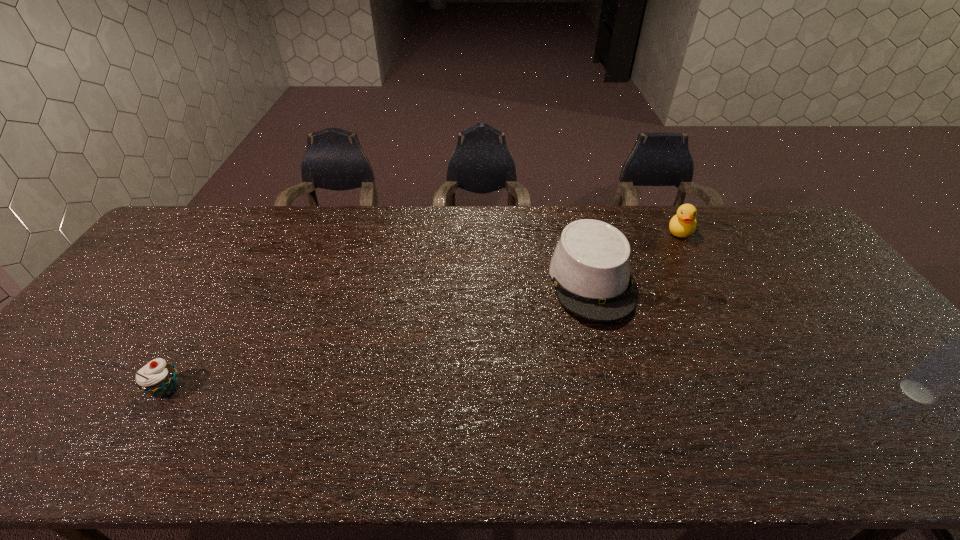
Where is `free space on the desktop that is between the cupcake and the tallest object and is positioned on the front-facing side of the hat`? This screenshot has width=960, height=540. free space on the desktop that is between the cupcake and the tallest object and is positioned on the front-facing side of the hat is located at coordinates (624, 391).

Where is `vacant space on the desktop that is between the cupcake and the water bottle and is positioned on the face of the duckling`? Image resolution: width=960 pixels, height=540 pixels. vacant space on the desktop that is between the cupcake and the water bottle and is positioned on the face of the duckling is located at coordinates (607, 391).